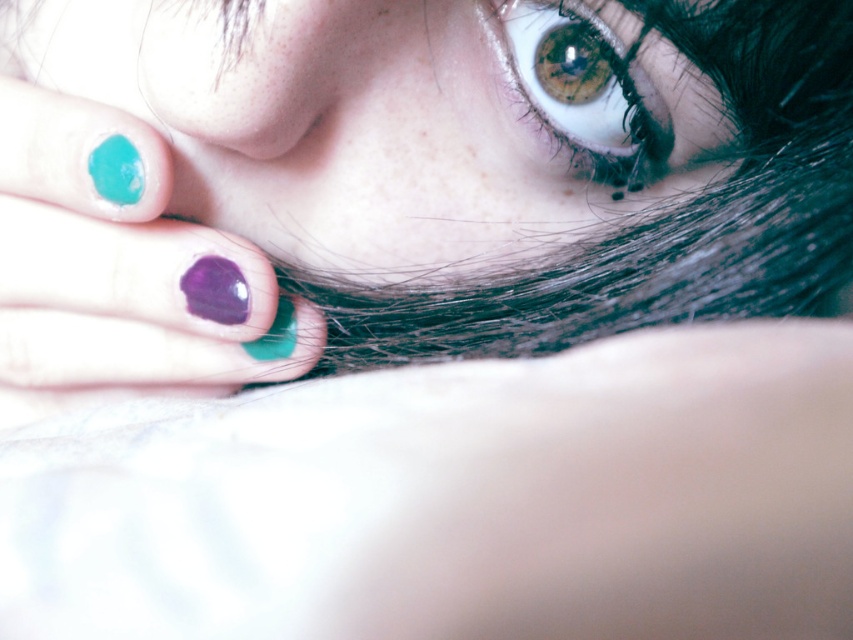
You are a photographer adjusting your camera settings to focus on the brown matte eye at upper center and the purple glossy nail polish at center. Which object should you focus on first to ensure both are in sharp focus?

The brown matte eye at upper center is closer to the viewer than the purple glossy nail polish at center, so you should focus on the brown matte eye at upper center first to ensure both are in sharp focus.

You are a makeup artist preparing for a client appointment. You have the teal glossy nails at upper left and the purple glossy nail polish at center. Which one should you choose if you want a larger application area for the design?

The teal glossy nails at upper left is bigger than the purple glossy nail polish at center, so you should choose the teal glossy nails at upper left for a larger application area.